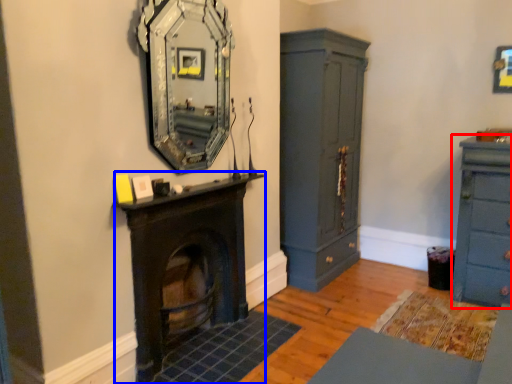
Question: Among these objects, which one is nearest to the camera, chest of drawers (highlighted by a red box) or fireplace (highlighted by a blue box)?

Choices:
 (A) chest of drawers
 (B) fireplace

Answer: (B)